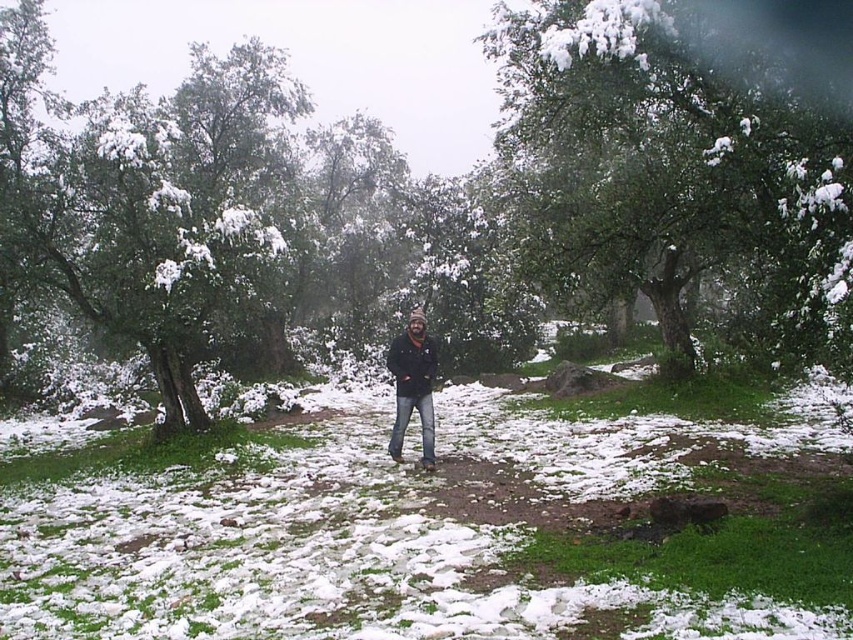
Which is above, white fluffy snow at center or black matte jacket at center?

black matte jacket at center is above.

Which is behind, point (207, 611) or point (401, 339)?

Positioned behind is point (401, 339).

Between point (546, 605) and point (403, 349), which one is positioned in front?

Positioned in front is point (546, 605).

Locate an element on the screen. white fluffy snow at center is located at coordinates (309, 556).

Looking at this image, measure the distance from dark blue jeans at center to black matte jacket at center.

dark blue jeans at center is 7.45 inches away from black matte jacket at center.

Identify the location of dark blue jeans at center. coord(413,385).

Locate an element on the screen. The width and height of the screenshot is (853, 640). dark blue jeans at center is located at coordinates (413, 385).

Consider the image. Does green textured tree at upper center have a smaller size compared to black matte jacket at center?

Incorrect, green textured tree at upper center is not smaller in size than black matte jacket at center.

Can you confirm if green textured tree at upper center is positioned above black matte jacket at center?

Indeed, green textured tree at upper center is positioned over black matte jacket at center.

Where is `green textured tree at upper center`? green textured tree at upper center is located at coordinates (671, 170).